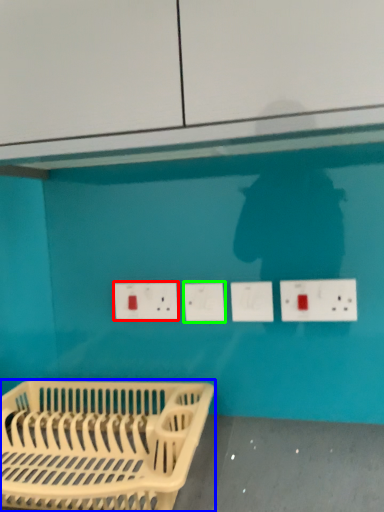
Question: Which object is the farthest from electric outlet (highlighted by a red box)? Choose among these: furniture (highlighted by a blue box) or socket (highlighted by a green box).

Choices:
 (A) furniture
 (B) socket

Answer: (A)